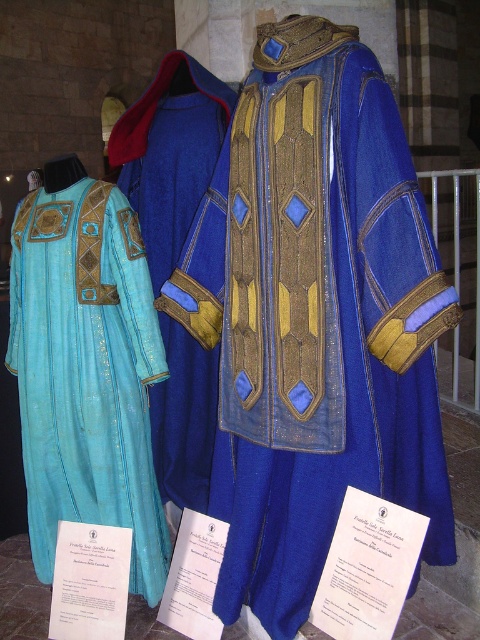
Question: Which of these objects is positioned closest to the matte blue fabric robe at left?

Choices:
 (A) velvet blue robe at center
 (B) blue velvet jacket at center

Answer: (A)

Question: Does blue velvet jacket at center appear under matte blue fabric robe at left?

Choices:
 (A) no
 (B) yes

Answer: (A)

Question: Can you confirm if blue velvet jacket at center is wider than velvet blue robe at center?

Choices:
 (A) no
 (B) yes

Answer: (B)

Question: Considering the relative positions of matte blue fabric robe at left and velvet blue robe at center in the image provided, where is matte blue fabric robe at left located with respect to velvet blue robe at center?

Choices:
 (A) right
 (B) left

Answer: (B)

Question: Estimate the real-world distances between objects in this image. Which object is closer to the velvet blue robe at center?

Choices:
 (A) matte blue fabric robe at left
 (B) blue velvet jacket at center

Answer: (A)

Question: Which object is the farthest from the velvet blue robe at center?

Choices:
 (A) blue velvet jacket at center
 (B) matte blue fabric robe at left

Answer: (A)